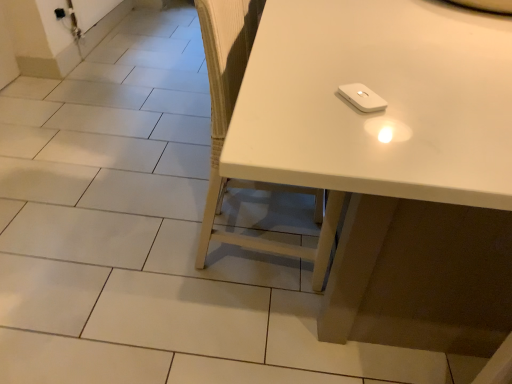
Looking at this image, what is the approximate width of white matte chair at center?

It is 50.59 centimeters.

Describe the element at coordinates (379, 116) in the screenshot. I see `white glossy table at upper right` at that location.

The width and height of the screenshot is (512, 384). In order to click on white matte wii controller at upper center in this screenshot , I will do `click(362, 97)`.

Who is taller, white matte chair at center or white glossy table at upper right?

white matte chair at center is taller.

What's the angular difference between white matte chair at center and white glossy table at upper right's facing directions?

white matte chair at center and white glossy table at upper right are facing 180 degrees away from each other.

Which object is thinner, white matte chair at center or white glossy table at upper right?

white matte chair at center.

Consider the image. Considering the sizes of objects white matte chair at center and white glossy table at upper right in the image provided, who is bigger, white matte chair at center or white glossy table at upper right?

white glossy table at upper right.

From the image's perspective, is white glossy table at upper right over white matte chair at center?

Yes, from the image's perspective, white glossy table at upper right is over white matte chair at center.

What's the angular difference between white glossy table at upper right and white matte chair at center's facing directions?

180 degrees.

Which of these two, white glossy table at upper right or white matte chair at center, stands shorter?

white glossy table at upper right.

From a real-world perspective, is white glossy table at upper right above or below white matte chair at center?

Clearly, from a real-world perspective, white glossy table at upper right is below white matte chair at center.

Between white glossy table at upper right and white matte wii controller at upper center, which one is positioned behind?

white matte wii controller at upper center is further from the camera.

At what (x,y) coordinates should I click in order to perform the action: click on table lying on the right of white matte wii controller at upper center. Please return your answer as a coordinate pair (x, y). Image resolution: width=512 pixels, height=384 pixels. Looking at the image, I should click on (379, 116).

Between point (343, 272) and point (342, 96), which one is positioned in front?

The point (342, 96) is closer.

Between point (234, 24) and point (354, 85), which one is positioned behind?

The point (234, 24) is behind.

Considering the positions of objects white matte chair at center and white matte wii controller at upper center in the image provided, who is in front, white matte chair at center or white matte wii controller at upper center?

white matte wii controller at upper center is more forward.

Between white matte chair at center and white matte wii controller at upper center, which one appears on the left side from the viewer's perspective?

From the viewer's perspective, white matte chair at center appears more on the left side.

Can you confirm if white matte chair at center is wider than white matte wii controller at upper center?

Indeed, white matte chair at center has a greater width compared to white matte wii controller at upper center.

From the image's perspective, between white matte wii controller at upper center and white matte chair at center, who is located below?

white matte chair at center appears lower in the image.

Does white matte wii controller at upper center have a greater height compared to white matte chair at center?

In fact, white matte wii controller at upper center may be shorter than white matte chair at center.

Does point (353, 101) come closer to viewer compared to point (222, 36)?

Yes, point (353, 101) is closer to viewer.

Is white matte wii controller at upper center with white glossy table at upper right?

No, white matte wii controller at upper center is not making contact with white glossy table at upper right.

Consider the image. Is white matte wii controller at upper center facing towards white glossy table at upper right?

Yes, white matte wii controller at upper center is aimed at white glossy table at upper right.

Does white matte wii controller at upper center lie in front of white glossy table at upper right?

No, white matte wii controller at upper center is further to the viewer.

Identify the location of chair behind the white glossy table at upper right. The image size is (512, 384). (227, 129).

In order to click on table on the right of the white matte chair at center in this screenshot , I will do `click(379, 116)`.

Considering their positions, is white matte chair at center positioned further to white glossy table at upper right than white matte wii controller at upper center?

white matte chair at center.

Looking at the image, which one is located closer to white glossy table at upper right, white matte wii controller at upper center or white matte chair at center?

Among the two, white matte wii controller at upper center is located nearer to white glossy table at upper right.

In the scene shown: When comparing their distances from white matte wii controller at upper center, does white matte chair at center or white glossy table at upper right seem further?

Based on the image, white matte chair at center appears to be further to white matte wii controller at upper center.

When comparing their distances from white matte chair at center, does white glossy table at upper right or white matte wii controller at upper center seem closer?

white glossy table at upper right.

Looking at the image, which one is located further to white matte chair at center, white matte wii controller at upper center or white glossy table at upper right?

The object further to white matte chair at center is white matte wii controller at upper center.

Which object lies nearer to the anchor point white matte wii controller at upper center, white glossy table at upper right or white matte chair at center?

The object closer to white matte wii controller at upper center is white glossy table at upper right.

Locate an element on the screen. This screenshot has width=512, height=384. Wii controller located between white matte chair at center and white glossy table at upper right in the left-right direction is located at coordinates (362, 97).